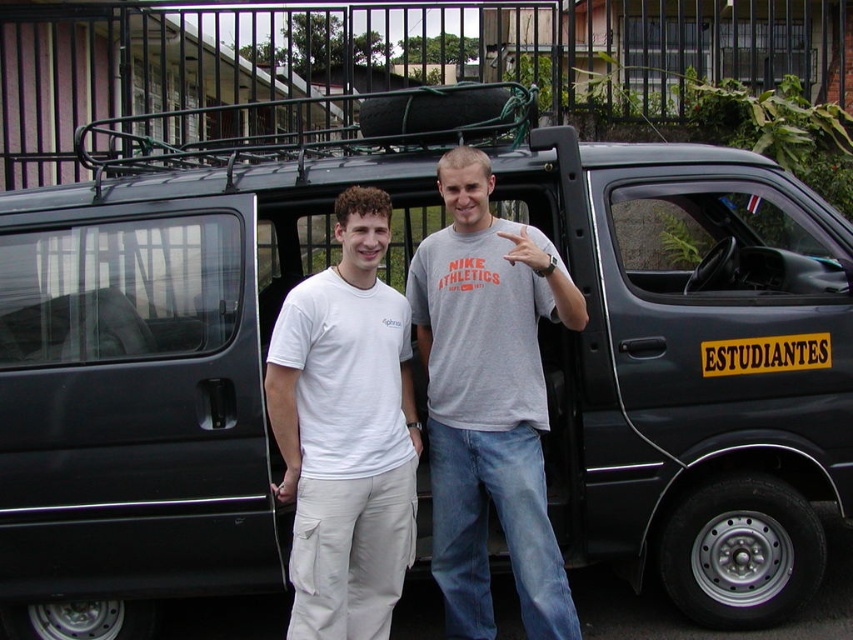
Is gray cotton t-shirt at center to the right of white cotton t-shirt at center from the viewer's perspective?

Yes, gray cotton t-shirt at center is to the right of white cotton t-shirt at center.

Does point (436, 490) come behind point (366, 532)?

Yes, it is.

Find the location of a particular element. gray cotton t-shirt at center is located at coordinates click(489, 401).